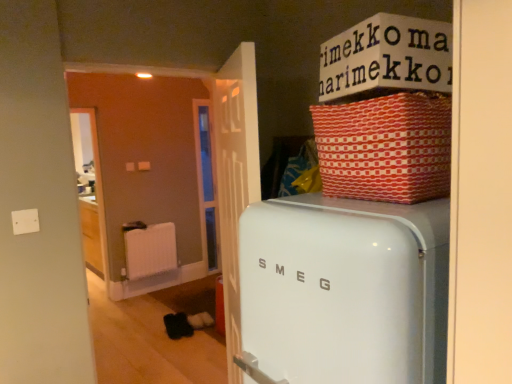
Question: Is white cardboard box at upper center bigger than white glossy refrigerator at center?

Choices:
 (A) yes
 (B) no

Answer: (B)

Question: Could you tell me if white cardboard box at upper center is facing white glossy refrigerator at center?

Choices:
 (A) yes
 (B) no

Answer: (B)

Question: Can you confirm if white cardboard box at upper center is smaller than white glossy refrigerator at center?

Choices:
 (A) no
 (B) yes

Answer: (B)

Question: Can you confirm if white cardboard box at upper center is thinner than white glossy refrigerator at center?

Choices:
 (A) no
 (B) yes

Answer: (B)

Question: Is white cardboard box at upper center outside white glossy refrigerator at center?

Choices:
 (A) yes
 (B) no

Answer: (A)

Question: From the image's perspective, is white plastic radiator at center positioned above or below white cardboard box at upper center?

Choices:
 (A) above
 (B) below

Answer: (B)

Question: Is white plastic radiator at center inside the boundaries of white cardboard box at upper center, or outside?

Choices:
 (A) inside
 (B) outside

Answer: (B)

Question: Considering the positions of white plastic radiator at center and white cardboard box at upper center in the image, is white plastic radiator at center wider or thinner than white cardboard box at upper center?

Choices:
 (A) wide
 (B) thin

Answer: (B)

Question: Considering the positions of point (135, 231) and point (342, 56), is point (135, 231) closer or farther from the camera than point (342, 56)?

Choices:
 (A) closer
 (B) farther

Answer: (B)

Question: From the image's perspective, is red woven basket at upper right above or below white glossy refrigerator at center?

Choices:
 (A) below
 (B) above

Answer: (B)

Question: From their relative heights in the image, would you say red woven basket at upper right is taller or shorter than white glossy refrigerator at center?

Choices:
 (A) tall
 (B) short

Answer: (B)

Question: Relative to white glossy refrigerator at center, is red woven basket at upper right in front or behind?

Choices:
 (A) behind
 (B) front

Answer: (A)

Question: Is red woven basket at upper right bigger or smaller than white glossy refrigerator at center?

Choices:
 (A) big
 (B) small

Answer: (B)

Question: Which is correct: red woven basket at upper right is inside white cardboard box at upper center, or outside of it?

Choices:
 (A) inside
 (B) outside

Answer: (B)

Question: Is point (448, 117) closer or farther from the camera than point (324, 72)?

Choices:
 (A) farther
 (B) closer

Answer: (B)